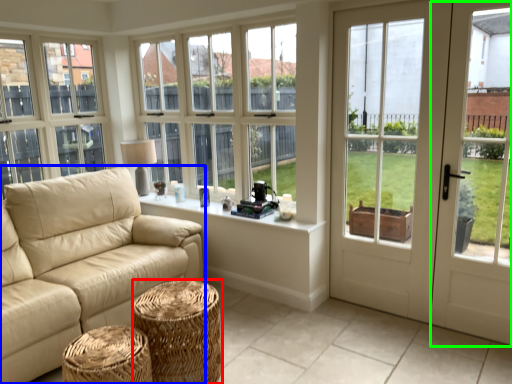
Question: Estimate the real-world distances between objects in this image. Which object is closer to stool (highlighted by a red box), studio couch (highlighted by a blue box) or screen door (highlighted by a green box)?

Choices:
 (A) studio couch
 (B) screen door

Answer: (A)